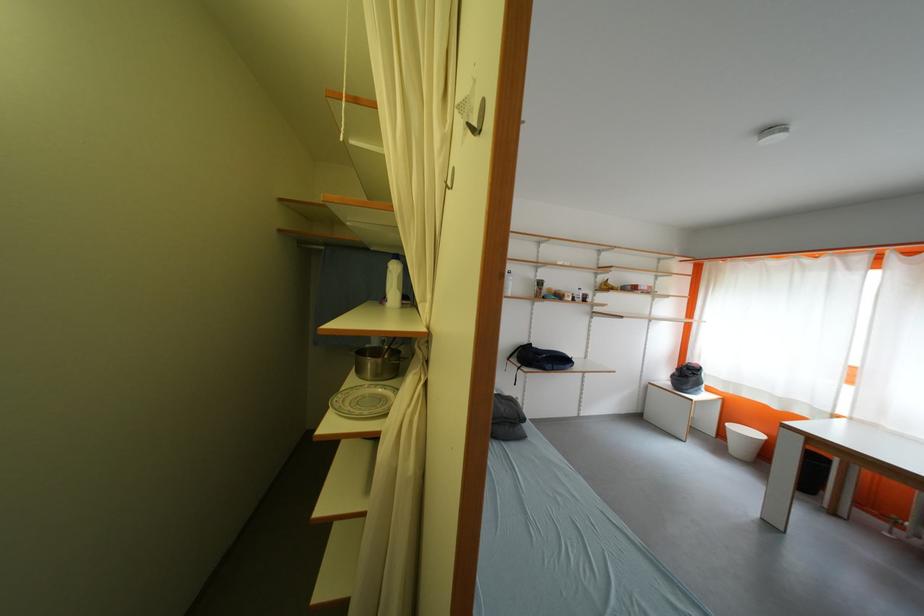
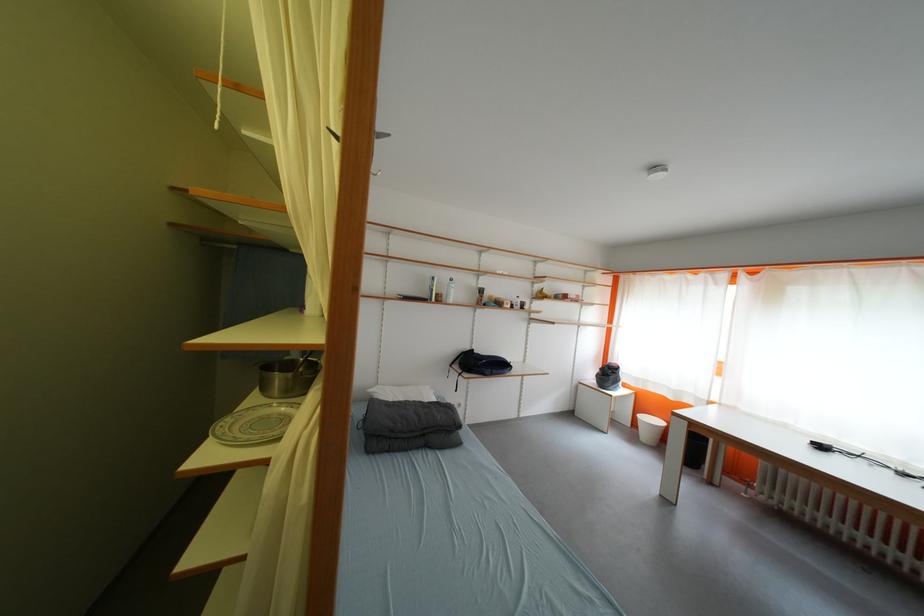
The point at (724, 447) is marked in the first image. Where is the corresponding point in the second image?

(639, 436)